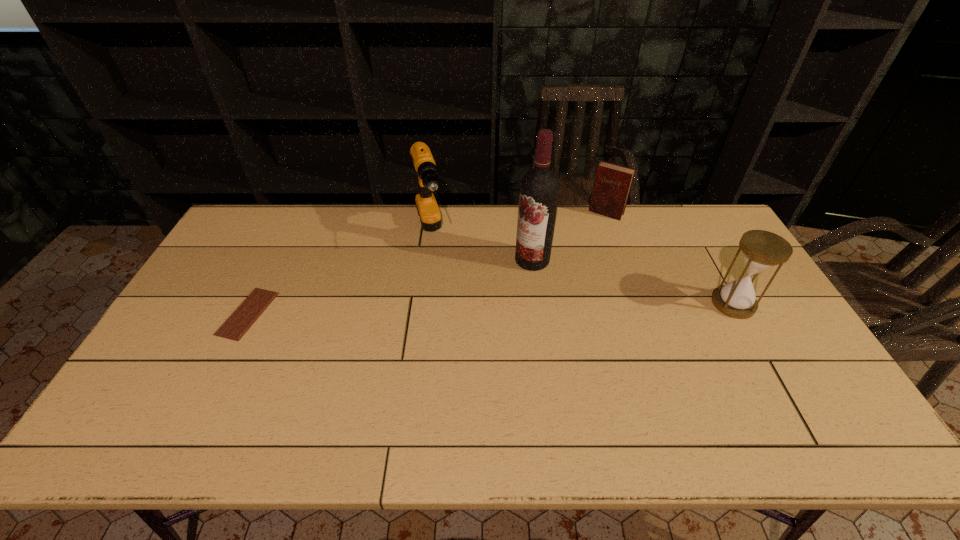
Locate an element on the screen. The width and height of the screenshot is (960, 540). free space on the desktop that is between the leftmost object and the hourglass and is positioned on the label of the wine bottle is located at coordinates (427, 310).

At what (x,y) coordinates should I click in order to perform the action: click on free spot on the desktop that is between the chocolate bar and the hourglass and is positioned at the tip of the fourth shortest object. Please return your answer as a coordinate pair (x, y). Looking at the image, I should click on (455, 309).

Locate an element on the screen. This screenshot has width=960, height=540. free space on the desktop that is between the shortest object and the hourglass and is positioned on the front cover of the diary is located at coordinates (547, 307).